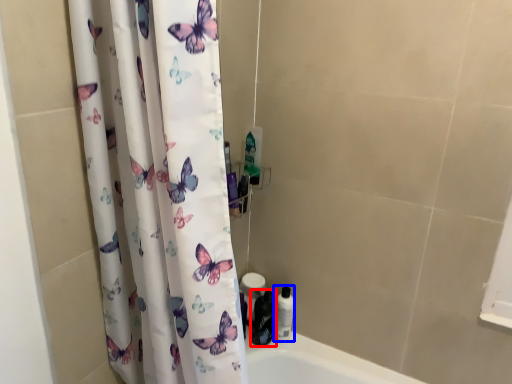
Question: Which object is further to the camera taking this photo, toiletry (highlighted by a red box) or toiletry (highlighted by a blue box)?

Choices:
 (A) toiletry
 (B) toiletry

Answer: (B)